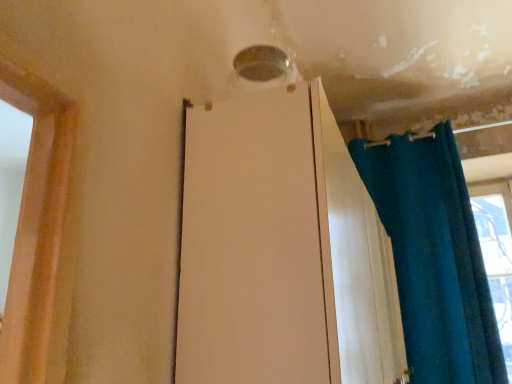
This screenshot has height=384, width=512. Describe the element at coordinates (434, 257) in the screenshot. I see `teal fabric curtain at right` at that location.

Image resolution: width=512 pixels, height=384 pixels. In order to click on teal fabric curtain at right in this screenshot , I will do `click(434, 257)`.

Describe the element at coordinates (255, 245) in the screenshot. The image size is (512, 384). I see `white matte screen door at center` at that location.

What are the coordinates of `white matte screen door at center` in the screenshot? It's located at (255, 245).

Locate an element on the screen. The height and width of the screenshot is (384, 512). teal fabric curtain at right is located at coordinates (434, 257).

Visually, is white matte screen door at center positioned to the left or to the right of teal fabric curtain at right?

white matte screen door at center is positioned on teal fabric curtain at right's left side.

Consider the image. Which object is more forward, white matte screen door at center or teal fabric curtain at right?

Positioned in front is white matte screen door at center.

Between point (224, 120) and point (437, 193), which one is positioned in front?

Positioned in front is point (224, 120).

Looking at this image, from the image's perspective, is white matte screen door at center under teal fabric curtain at right?

Yes.

From a real-world perspective, is white matte screen door at center located beneath teal fabric curtain at right?

Yes, from a real-world perspective, white matte screen door at center is beneath teal fabric curtain at right.

From the picture: In terms of width, does white matte screen door at center look wider or thinner when compared to teal fabric curtain at right?

white matte screen door at center is wider than teal fabric curtain at right.

Considering the relative sizes of white matte screen door at center and teal fabric curtain at right in the image provided, is white matte screen door at center taller than teal fabric curtain at right?

Incorrect, the height of white matte screen door at center is not larger of that of teal fabric curtain at right.

Is white matte screen door at center bigger or smaller than teal fabric curtain at right?

Considering their sizes, white matte screen door at center takes up more space than teal fabric curtain at right.

Can we say white matte screen door at center lies outside teal fabric curtain at right?

Yes, white matte screen door at center is located beyond the bounds of teal fabric curtain at right.

From the picture: Are white matte screen door at center and teal fabric curtain at right making contact?

No, white matte screen door at center is not making contact with teal fabric curtain at right.

Is teal fabric curtain at right at the back of white matte screen door at center?

No, teal fabric curtain at right is not at the back of white matte screen door at center.

How different are the orientations of white matte screen door at center and teal fabric curtain at right in degrees?

There is a 91.2-degree angle between the facing directions of white matte screen door at center and teal fabric curtain at right.

At what (x,y) coordinates should I click in order to perform the action: click on screen door below the teal fabric curtain at right (from the image's perspective). Please return your answer as a coordinate pair (x, y). The width and height of the screenshot is (512, 384). Looking at the image, I should click on (255, 245).

Is teal fabric curtain at right to the left of white matte screen door at center from the viewer's perspective?

No, teal fabric curtain at right is not to the left of white matte screen door at center.

Is teal fabric curtain at right positioned behind white matte screen door at center?

Yes, teal fabric curtain at right is behind white matte screen door at center.

Which point is more distant from viewer, (465, 193) or (228, 282)?

The point (465, 193) is more distant.

From the image's perspective, is teal fabric curtain at right above or below white matte screen door at center?

teal fabric curtain at right is situated higher than white matte screen door at center in the image.

From a real-world perspective, is teal fabric curtain at right above or below white matte screen door at center?

teal fabric curtain at right is situated higher than white matte screen door at center in the real world.

Can you confirm if teal fabric curtain at right is thinner than white matte screen door at center?

Yes, teal fabric curtain at right is thinner than white matte screen door at center.

Considering the relative sizes of teal fabric curtain at right and white matte screen door at center in the image provided, is teal fabric curtain at right shorter than white matte screen door at center?

No.

Which of these two, teal fabric curtain at right or white matte screen door at center, is smaller?

teal fabric curtain at right is smaller.

Can we say teal fabric curtain at right lies outside white matte screen door at center?

teal fabric curtain at right lies outside white matte screen door at center's area.

Can you see teal fabric curtain at right touching white matte screen door at center?

No, teal fabric curtain at right is not with white matte screen door at center.

Does teal fabric curtain at right turn towards white matte screen door at center?

Yes, teal fabric curtain at right is facing white matte screen door at center.

Measure the distance from teal fabric curtain at right to white matte screen door at center.

A distance of 5.65 feet exists between teal fabric curtain at right and white matte screen door at center.

The width and height of the screenshot is (512, 384). Identify the location of curtain behind the white matte screen door at center. (434, 257).

In order to click on screen door in front of the teal fabric curtain at right in this screenshot , I will do `click(255, 245)`.

At what (x,y) coordinates should I click in order to perform the action: click on curtain above the white matte screen door at center (from a real-world perspective). Please return your answer as a coordinate pair (x, y). This screenshot has height=384, width=512. Looking at the image, I should click on (434, 257).